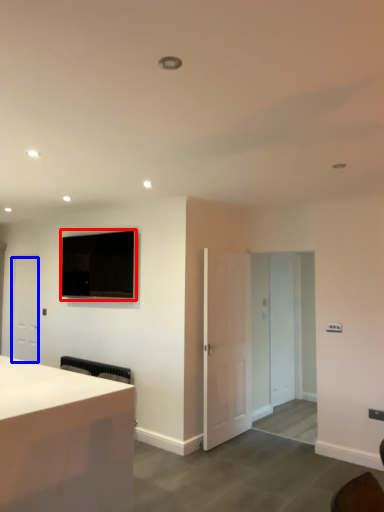
Question: Which of the following is the farthest to the observer, television (highlighted by a red box) or door (highlighted by a blue box)?

Choices:
 (A) television
 (B) door

Answer: (B)